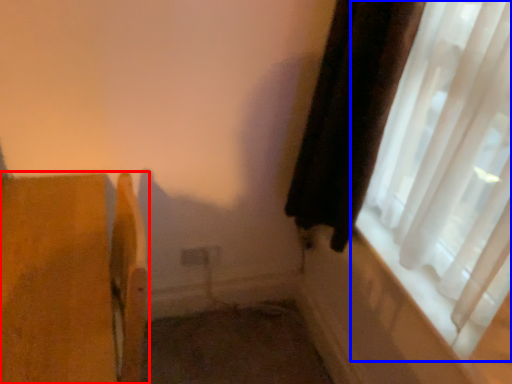
Question: Which object appears farthest to the camera in this image, furniture (highlighted by a red box) or window (highlighted by a blue box)?

Choices:
 (A) furniture
 (B) window

Answer: (A)